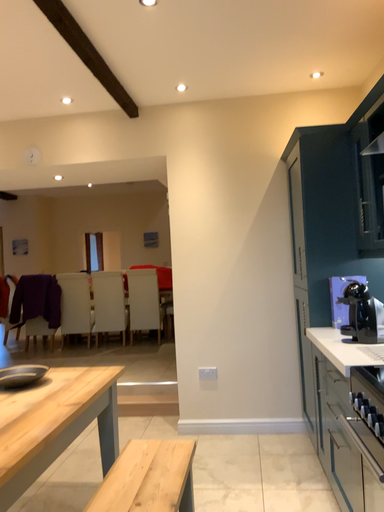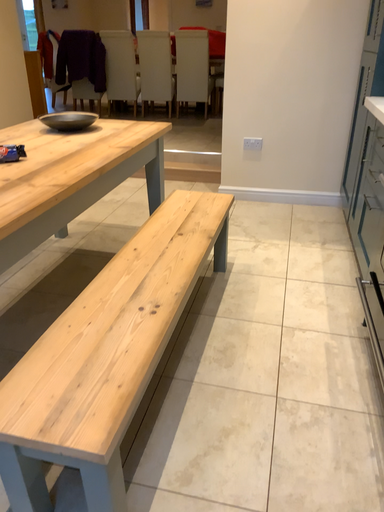
Question: How did the camera likely rotate when shooting the video?

Choices:
 (A) rotated left
 (B) rotated right

Answer: (A)